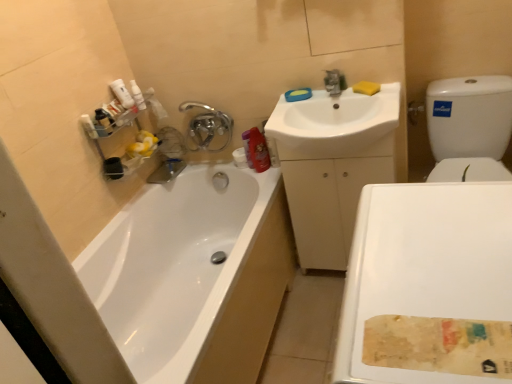
Question: Does silver metallic faucet at upper center have a lesser height compared to white glossy sink at upper center?

Choices:
 (A) no
 (B) yes

Answer: (A)

Question: From a real-world perspective, is silver metallic faucet at upper center physically above white glossy sink at upper center?

Choices:
 (A) yes
 (B) no

Answer: (B)

Question: Is silver metallic faucet at upper center taller than white glossy sink at upper center?

Choices:
 (A) no
 (B) yes

Answer: (B)

Question: Considering the relative sizes of silver metallic faucet at upper center and white glossy sink at upper center in the image provided, is silver metallic faucet at upper center bigger than white glossy sink at upper center?

Choices:
 (A) no
 (B) yes

Answer: (A)

Question: From the image's perspective, is silver metallic faucet at upper center located above white glossy sink at upper center?

Choices:
 (A) yes
 (B) no

Answer: (A)

Question: Is point (373, 92) positioned closer to the camera than point (147, 195)?

Choices:
 (A) farther
 (B) closer

Answer: (B)

Question: From their relative heights in the image, would you say yellow sponge at upper center is taller or shorter than white glossy bathtub at left?

Choices:
 (A) short
 (B) tall

Answer: (A)

Question: Based on their sizes in the image, would you say yellow sponge at upper center is bigger or smaller than white glossy bathtub at left?

Choices:
 (A) small
 (B) big

Answer: (A)

Question: Is yellow sponge at upper center in front of or behind white glossy bathtub at left in the image?

Choices:
 (A) front
 (B) behind

Answer: (B)

Question: Considering their positions, is matte red bottle at upper right, the first cleaning product in the bottom-to-top sequence, located in front of or behind white glossy sink at upper center?

Choices:
 (A) behind
 (B) front

Answer: (A)

Question: Considering the positions of point (249, 163) and point (324, 132), is point (249, 163) closer or farther from the camera than point (324, 132)?

Choices:
 (A) closer
 (B) farther

Answer: (B)

Question: Is matte red bottle at upper right, the second cleaning product in the left-to-right sequence, situated inside white glossy sink at upper center or outside?

Choices:
 (A) inside
 (B) outside

Answer: (B)

Question: In terms of height, does matte red bottle at upper right, the second cleaning product positioned from the top, look taller or shorter compared to white glossy sink at upper center?

Choices:
 (A) short
 (B) tall

Answer: (B)

Question: From a real-world perspective, is white glossy toilet at right physically located above or below silver metallic faucet at upper center?

Choices:
 (A) above
 (B) below

Answer: (B)

Question: Is white glossy toilet at right situated inside silver metallic faucet at upper center or outside?

Choices:
 (A) outside
 (B) inside

Answer: (A)